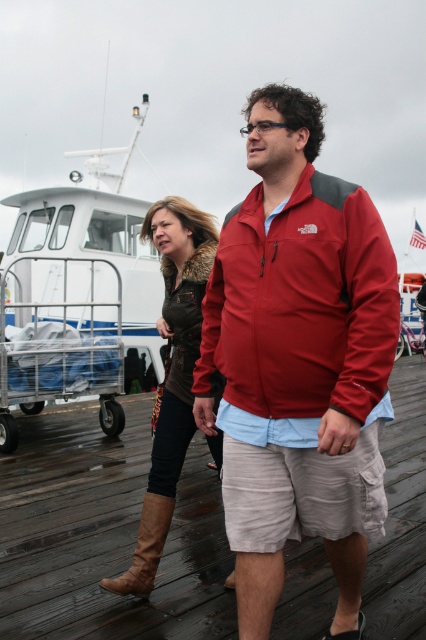
You are standing on the wooden dock and want to place a small potted plant exactly where the brown leather boots at lower left are located. What are the coordinates where you should place the plant?

You should place the small potted plant at coordinates point (106,532) where the brown leather boots at lower left are located.

You are standing on the wooden dock and want to take a photo of the brown leather boots at lower left without the matte red jacket at center appearing in the frame. Is this possible given their positions?

The matte red jacket at center is behind brown leather boots at lower left, so if you position yourself in front of the brown leather boots at lower left and aim the camera away from the direction of the matte red jacket at center, you can capture the boots without the jacket obstructing the view.